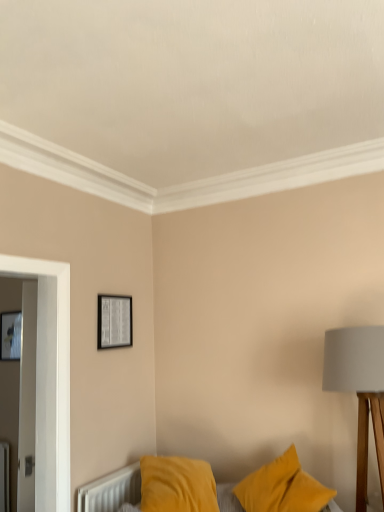
Question: From their relative heights in the image, would you say matte gray fabric lampshade at right is taller or shorter than matte black picture frame at upper center, which is counted as the 2th picture frame, starting from the left?

Choices:
 (A) tall
 (B) short

Answer: (A)

Question: From a real-world perspective, is matte gray fabric lampshade at right physically located above or below matte black picture frame at upper center, which is counted as the 2th picture frame, starting from the left?

Choices:
 (A) below
 (B) above

Answer: (A)

Question: Which is nearer to the matte black picture frame at upper center, which is counted as the 2th picture frame, starting from the left?

Choices:
 (A) velvet yellow pillows at lower center
 (B) matte gray fabric lampshade at right
 (C) matte black picture frame at upper left, the first picture frame when ordered from back to front

Answer: (A)

Question: Which object is positioned closest to the velvet yellow pillows at lower center?

Choices:
 (A) matte black picture frame at upper left, which is counted as the 2th picture frame, starting from the front
 (B) matte gray fabric lampshade at right
 (C) matte black picture frame at upper center, arranged as the 1th picture frame when viewed from the front

Answer: (C)